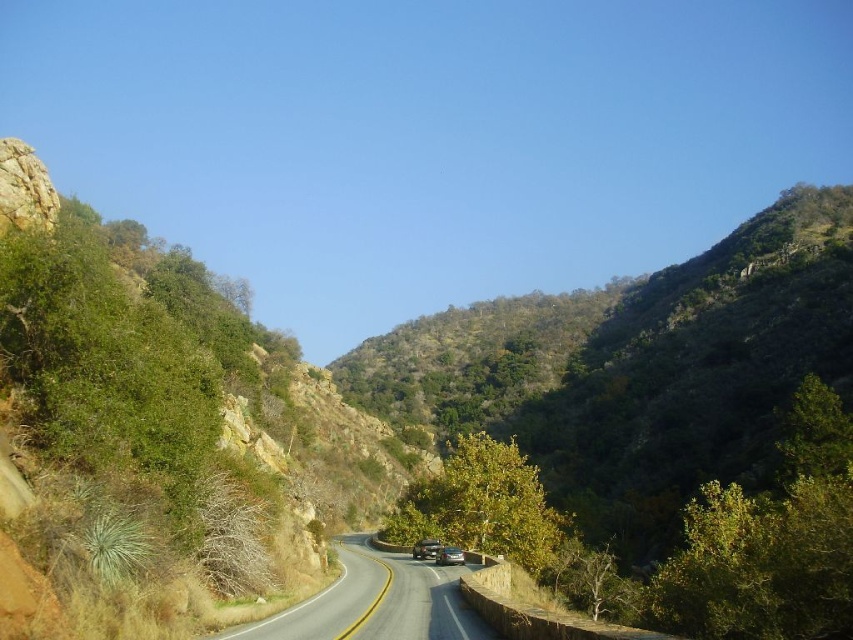
You are a driver approaching the black asphalt road at center and shiny silver sedan at center. Which object is higher from the ground?

The black asphalt road at center is much taller than the shiny silver sedan at center, so the black asphalt road at center is higher from the ground.

You are a driver approaching the black asphalt road at center and see the shiny silver sedan at center ahead. Is the sedan on the road or off the road?

The shiny silver sedan at center is off the road because the black asphalt road at center is above it, indicating the sedan is positioned below the road level.

You are driving a car and want to park on the black asphalt road at center. However, there is a shiny silver sedan at center already parked there. Can you park your car there without moving the sedan?

The black asphalt road at center is closer to the viewer than the shiny silver sedan at center, which means the sedan is parked further ahead on the road. You can park your car behind the sedan since there is space available on the road closer to you.